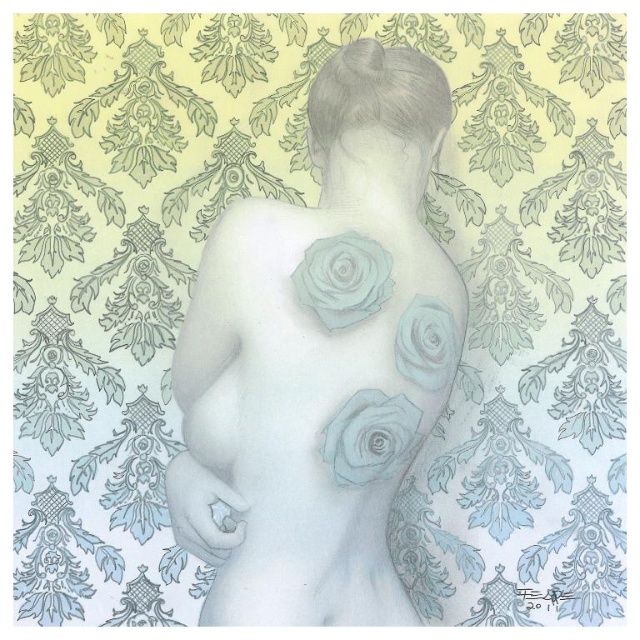
Based on the scene description, which rose has a greater width between the light blue pastel rose at upper center and the matte gray rose at center?

The light blue pastel rose at upper center has a greater width than the matte gray rose at center.